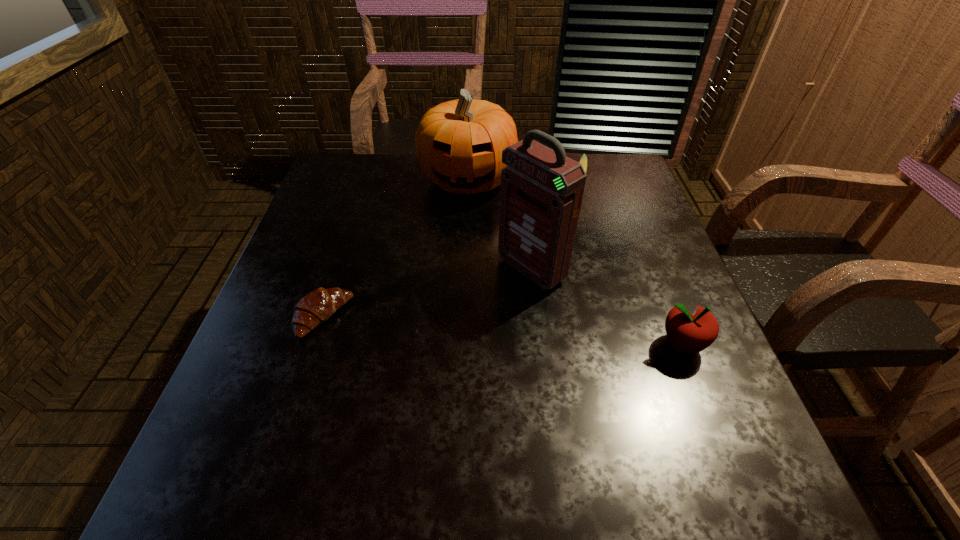
Locate an element on the screen. vacant spot on the desktop that is between the leftmost object and the rightmost object and is positioned on the front-facing side of the fourth shortest object is located at coordinates (446, 327).

I want to click on vacant space on the desktop that is between the crescent roll and the third shortest object and is positioned at the stem of the fourth tallest object, so click(545, 335).

You are a GUI agent. You are given a task and a screenshot of the screen. Output one action in this format:
    pyautogui.click(x=<x>, y=<y>)
    Task: Click on the free spot on the desktop that is between the leftmost object and the apple and is positioned on the front-facing side of the first-aid kit
    The image size is (960, 540).
    Given the screenshot: What is the action you would take?
    pyautogui.click(x=445, y=327)